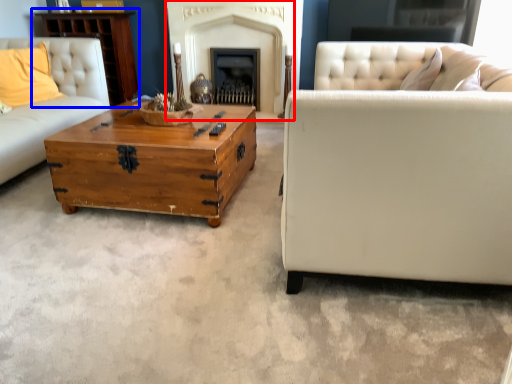
Question: Which object appears closest to the camera in this image, fireplace (highlighted by a red box) or dresser (highlighted by a blue box)?

Choices:
 (A) fireplace
 (B) dresser

Answer: (A)